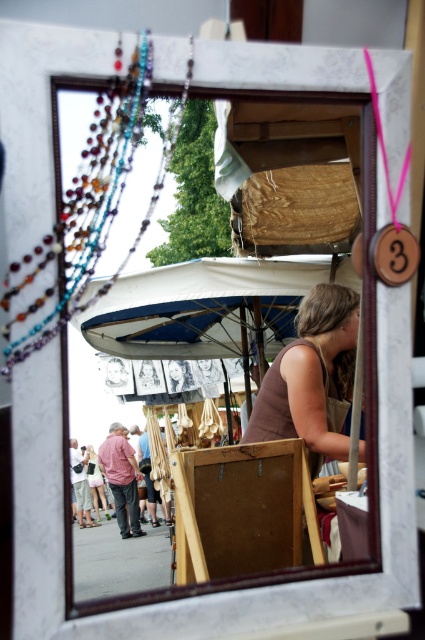
You are a customer at the market and see the multicolored beaded necklace at upper left and the light pink fabric dress at lower left reflected in the mirror. Which item is closer to you in the reflection?

The multicolored beaded necklace at upper left is closer to you in the reflection because it is in front of the light pink fabric dress at lower left.

You are a customer in the market and want to buy the brown matte tank top at center. The vendor tells you that the tank top is hidden under the white fabric canopy at center. Can you see the tank top from your current position?

The white fabric canopy at center is larger in size than brown matte tank top at center, so it is likely that the tank top is completely or partially covered by the canopy. Therefore, you may not be able to see the brown matte tank top at center clearly from your current position.